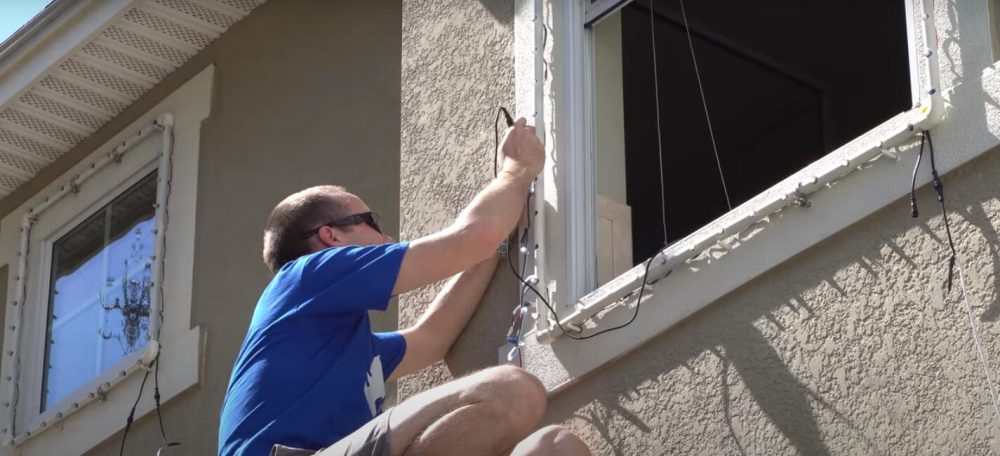
Where is `window`? The height and width of the screenshot is (456, 1000). window is located at coordinates (89, 338).